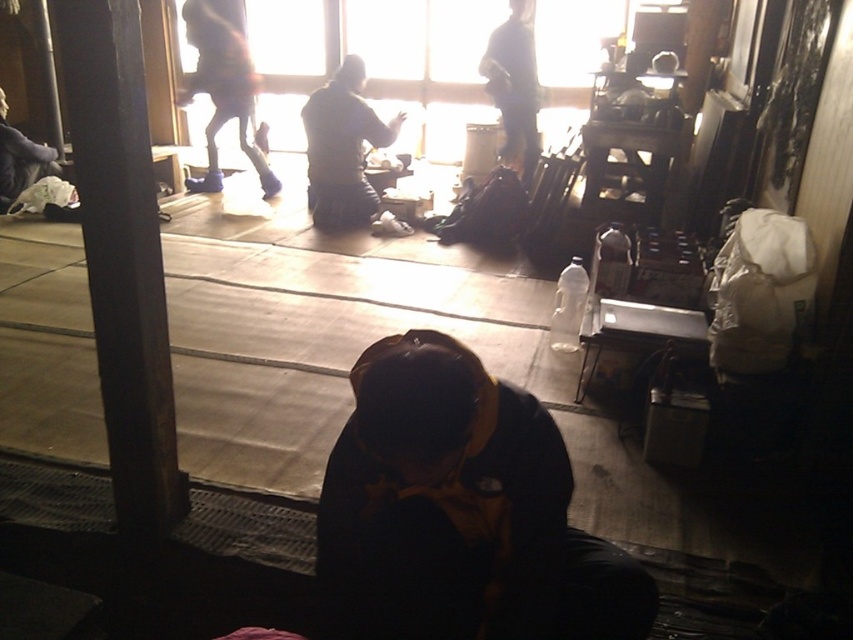
Is the position of dark yellow fabric at center less distant than that of dark blue jeans at upper center?

Yes, dark yellow fabric at center is in front of dark blue jeans at upper center.

Who is positioned more to the left, dark yellow fabric at center or dark blue jeans at upper center?

From the viewer's perspective, dark yellow fabric at center appears more on the left side.

Does point (467, 579) come behind point (527, 77)?

No, it is in front of (527, 77).

Locate an element on the screen. dark yellow fabric at center is located at coordinates (460, 512).

The image size is (853, 640). Describe the element at coordinates (460, 512) in the screenshot. I see `dark yellow fabric at center` at that location.

Is dark yellow fabric at center below blue fabric pants at upper center?

Yes, dark yellow fabric at center is below blue fabric pants at upper center.

Who is more forward, (531, 456) or (251, 84)?

Point (531, 456) is in front.

Identify the location of dark yellow fabric at center. The height and width of the screenshot is (640, 853). (460, 512).

Does dark yellow fabric at center have a greater width compared to dark brown wood pillar at left?

Yes, dark yellow fabric at center is wider than dark brown wood pillar at left.

Between point (459, 620) and point (108, 100), which one is positioned behind?

The point (108, 100) is behind.

You are a GUI agent. You are given a task and a screenshot of the screen. Output one action in this format:
    pyautogui.click(x=<x>, y=<y>)
    Task: Click on the dark yellow fabric at center
    This screenshot has height=640, width=853.
    Given the screenshot: What is the action you would take?
    pyautogui.click(x=460, y=512)